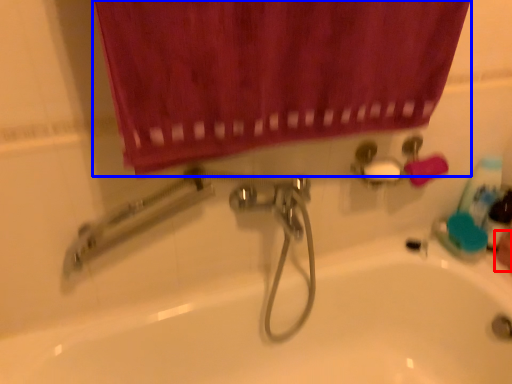
Question: Which of the following is the closest to the observer, hand (highlighted by a red box) or curtain (highlighted by a blue box)?

Choices:
 (A) hand
 (B) curtain

Answer: (B)